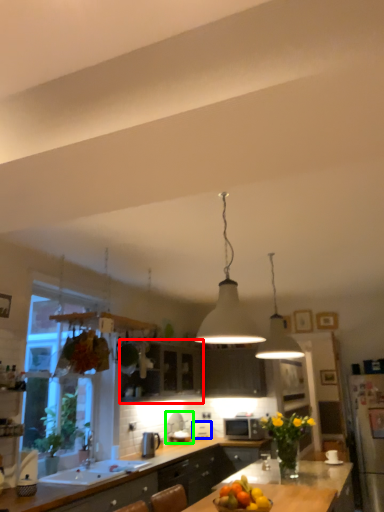
Question: Which is farther away from cabinetry (highlighted by a red box)? appliance (highlighted by a blue box) or appliance (highlighted by a green box)?

Choices:
 (A) appliance
 (B) appliance

Answer: (A)